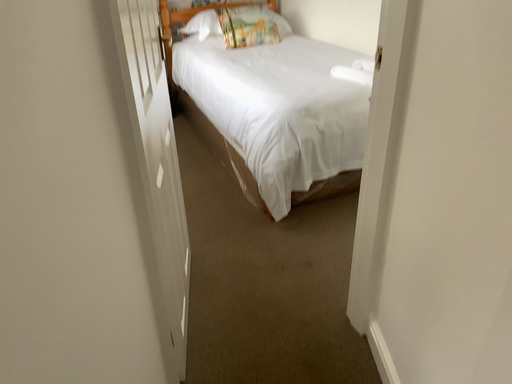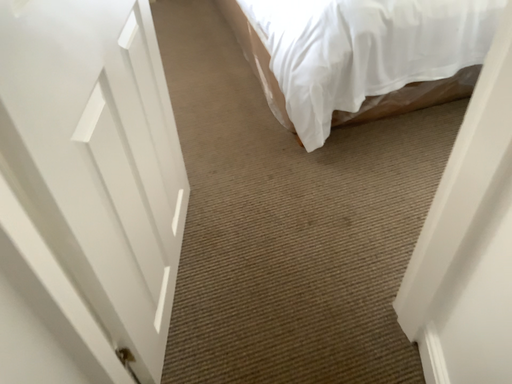
Question: Which way did the camera rotate in the video?

Choices:
 (A) rotated upward
 (B) rotated downward

Answer: (B)